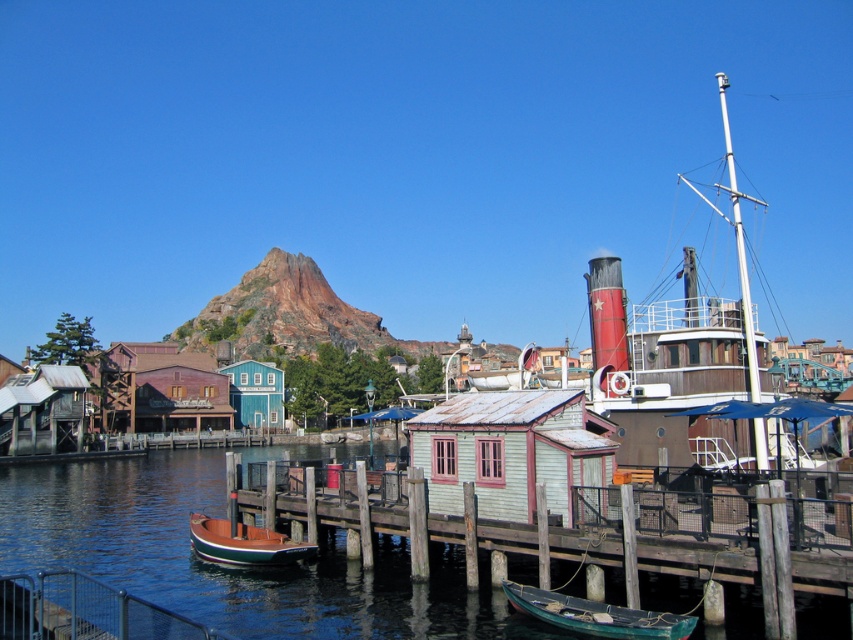
You are a tour guide leading a group of visitors to the green painted wood boat at lower center. You are currently standing at the blue water at dock center. Can you walk directly to the boat without needing to go around any obstacles?

The blue water at dock center and green painted wood boat at lower center are 14.89 meters apart. Since there is no mention of obstacles between them in the scene description, you can walk directly to the boat.

You are a visitor at the waterfront and want to take a photo of both the rusty corrugated metal hut at lower left and the green polished wood boat at lower left. Since you want both in the frame, which object should you stand closer to to ensure both fit in your camera view?

You should stand closer to the green polished wood boat at lower left because the rusty corrugated metal hut at lower left is much taller than the green polished wood boat at lower left. By moving closer to the shorter boat, you can include both the taller hut and the boat in your camera view without excluding either due to height differences.

You are standing at the entrance of the waterfront scene and want to find the light blue wooden hut at center. According to the coordinates provided, in which direction should you walk to reach it?

The light blue wooden hut at center is located at point (511, 451). Since you are at the entrance, which is likely at the lower edge of the frame, you should walk towards the center and slightly to the right to reach the coordinates (511, 451).